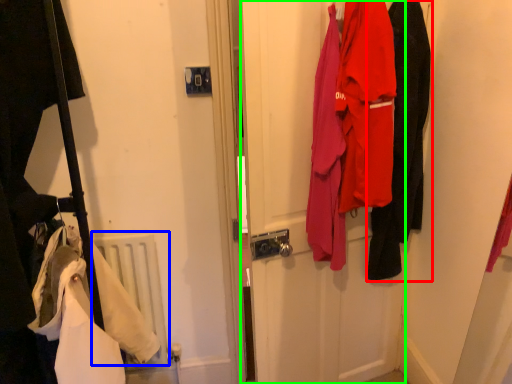
Question: Which object is the farthest from clothing (highlighted by a red box)? Choose among these: radiator (highlighted by a blue box) or door (highlighted by a green box).

Choices:
 (A) radiator
 (B) door

Answer: (A)